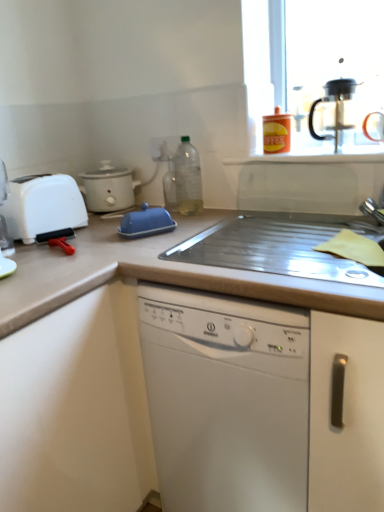
Where is `vacant area that is in front of orange matte coffee canister at upper right, the 1th kitchen appliance from the right`? Image resolution: width=384 pixels, height=512 pixels. vacant area that is in front of orange matte coffee canister at upper right, the 1th kitchen appliance from the right is located at coordinates (305, 153).